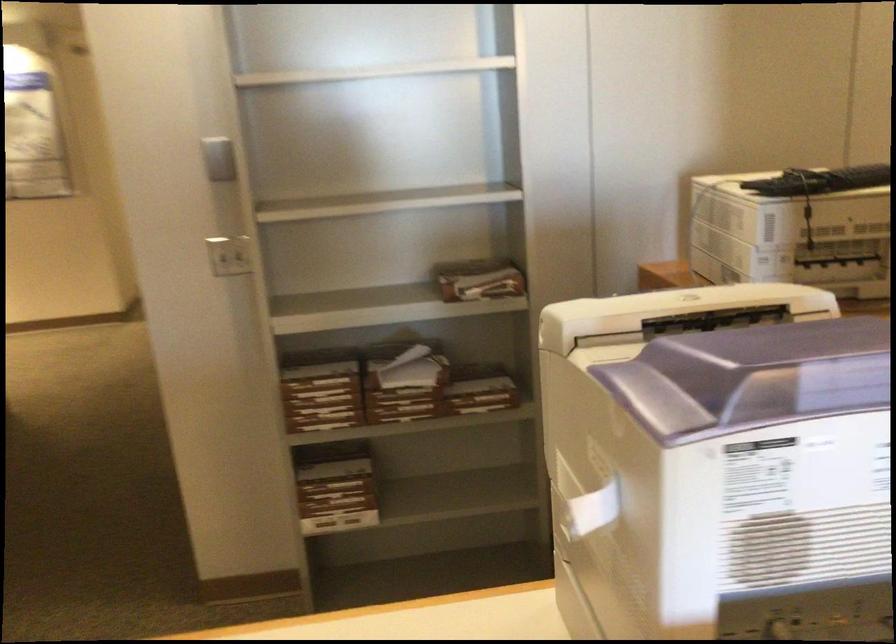
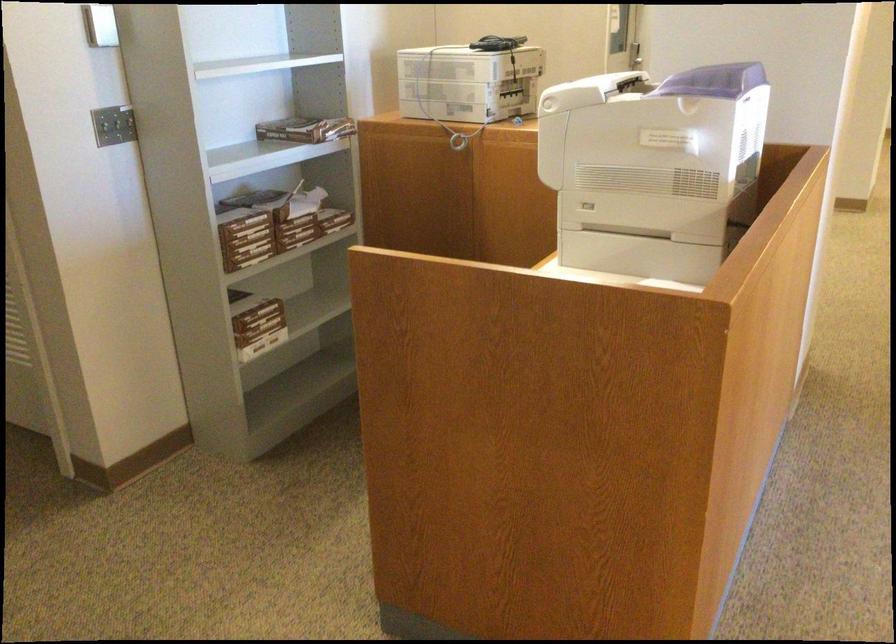
The point at (393,408) is marked in the first image. Where is the corresponding point in the second image?

(297, 231)